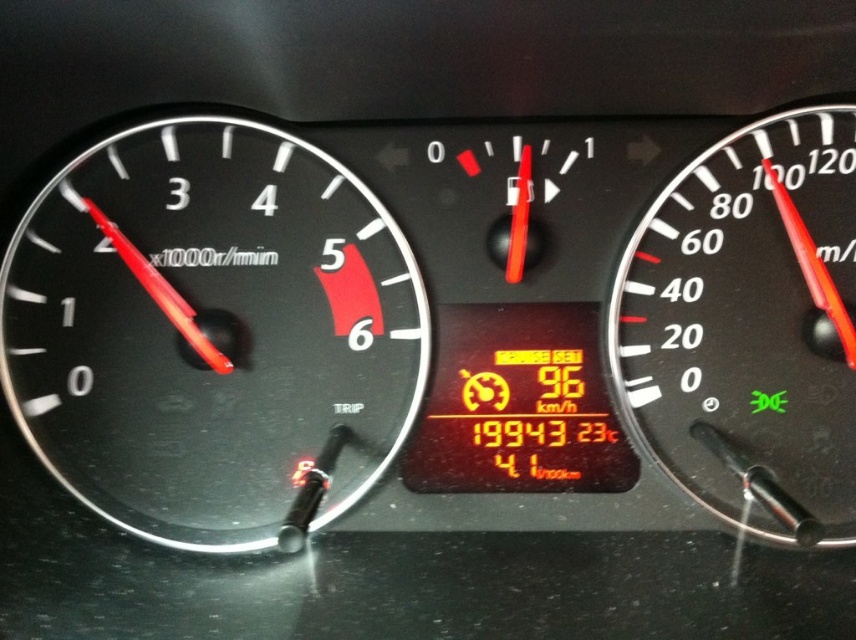
Question: Can you confirm if black matte speedometer at left is positioned below black plastic speedometer at right?

Choices:
 (A) no
 (B) yes

Answer: (A)

Question: Is black matte speedometer at left to the right of black plastic speedometer at right from the viewer's perspective?

Choices:
 (A) no
 (B) yes

Answer: (A)

Question: Which object is farther from the camera taking this photo?

Choices:
 (A) black matte speedometer at left
 (B) black plastic speedometer at right

Answer: (A)

Question: Is black matte speedometer at left thinner than black plastic speedometer at right?

Choices:
 (A) no
 (B) yes

Answer: (A)

Question: Among these points, which one is nearest to the camera?

Choices:
 (A) (755, 433)
 (B) (181, 260)

Answer: (A)